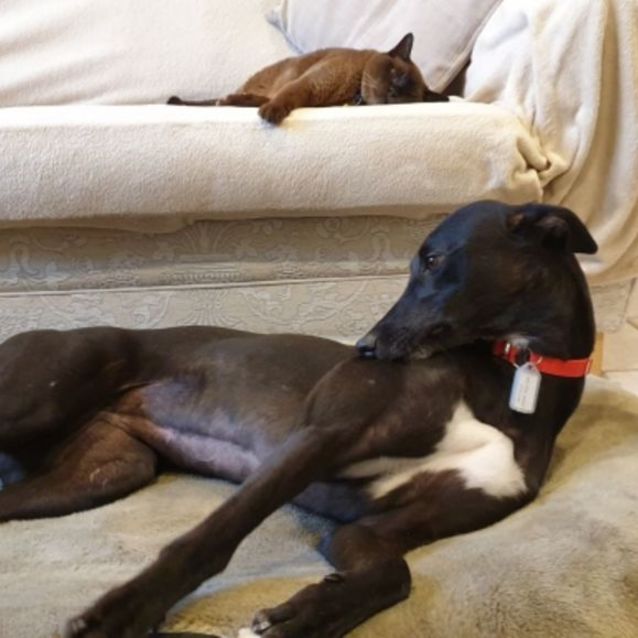
Identify the location of white couch. (154, 147).